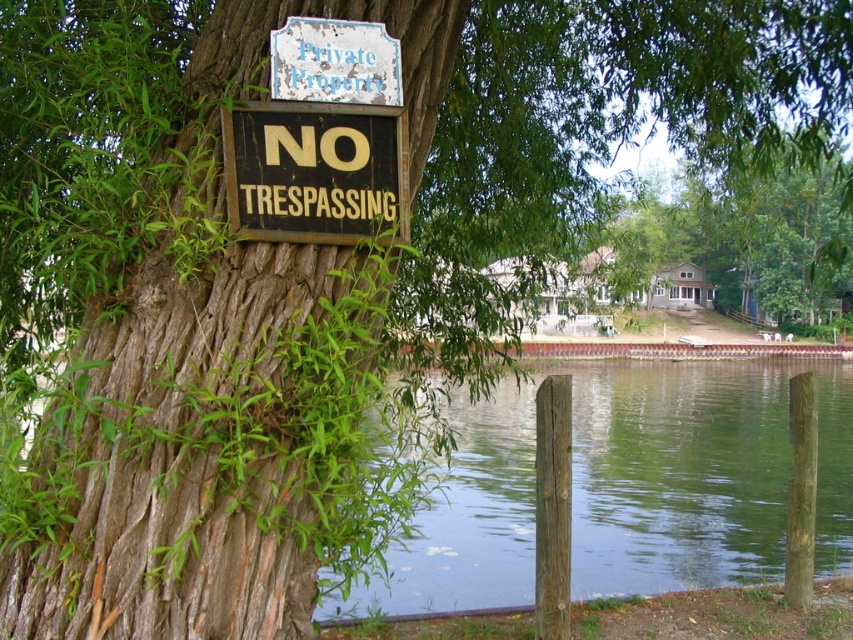
You are standing at the lakeside and see the green water at lower center and the white faded wood sign at upper center. Which object is positioned to the right of the other?

The green water at lower center is to the right of the white faded wood sign at upper center.

You are a hiker who just arrived at this lakeside area and see the black wood sign at upper center and the white faded wood sign at upper center. Which sign is bigger?

The black wood sign at upper center is larger in size than the white faded wood sign at upper center.

You are standing at the lakeside and want to take a photo of the black wood sign at upper center and the green water at lower center. Which one will appear bigger in your photo?

The green water at lower center will appear bigger in the photo because it has a larger size compared to the black wood sign at upper center.